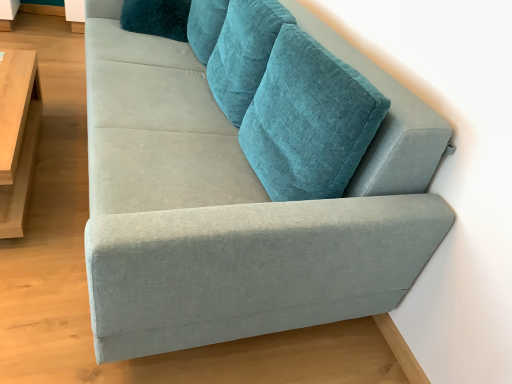
Question: From a real-world perspective, does velvet teal couch at upper right sit lower than teal velvet pillow at upper center?

Choices:
 (A) yes
 (B) no

Answer: (A)

Question: From the image's perspective, is velvet teal couch at upper right beneath teal velvet pillow at upper center?

Choices:
 (A) yes
 (B) no

Answer: (A)

Question: Can you confirm if velvet teal couch at upper right is positioned to the left of teal velvet pillow at upper center?

Choices:
 (A) no
 (B) yes

Answer: (A)

Question: Is velvet teal couch at upper right to the right of teal velvet pillow at upper center from the viewer's perspective?

Choices:
 (A) no
 (B) yes

Answer: (B)

Question: Is teal velvet pillow at upper center surrounded by velvet teal couch at upper right?

Choices:
 (A) yes
 (B) no

Answer: (A)

Question: Considering the relative positions of velvet teal couch at upper right and teal velvet pillow at upper center in the image provided, is velvet teal couch at upper right to the left or to the right of teal velvet pillow at upper center?

Choices:
 (A) right
 (B) left

Answer: (A)

Question: In terms of height, does velvet teal couch at upper right look taller or shorter compared to teal velvet pillow at upper center?

Choices:
 (A) short
 (B) tall

Answer: (B)

Question: From a real-world perspective, is velvet teal couch at upper right above or below teal velvet pillow at upper center?

Choices:
 (A) below
 (B) above

Answer: (A)

Question: Is velvet teal couch at upper right in front of or behind teal velvet pillow at upper center in the image?

Choices:
 (A) behind
 (B) front

Answer: (B)

Question: Is light wood/wooden table at left taller or shorter than teal velvet pillow at upper center?

Choices:
 (A) short
 (B) tall

Answer: (B)

Question: In the image, is light wood/wooden table at left on the left side or the right side of teal velvet pillow at upper center?

Choices:
 (A) left
 (B) right

Answer: (A)

Question: From a real-world perspective, is light wood/wooden table at left above or below teal velvet pillow at upper center?

Choices:
 (A) below
 (B) above

Answer: (A)

Question: Considering their positions, is light wood/wooden table at left located in front of or behind teal velvet pillow at upper center?

Choices:
 (A) behind
 (B) front

Answer: (B)

Question: Is velvet teal couch at upper right in front of or behind light wood/wooden table at left in the image?

Choices:
 (A) behind
 (B) front

Answer: (B)

Question: Is point (337, 39) closer or farther from the camera than point (30, 167)?

Choices:
 (A) farther
 (B) closer

Answer: (B)